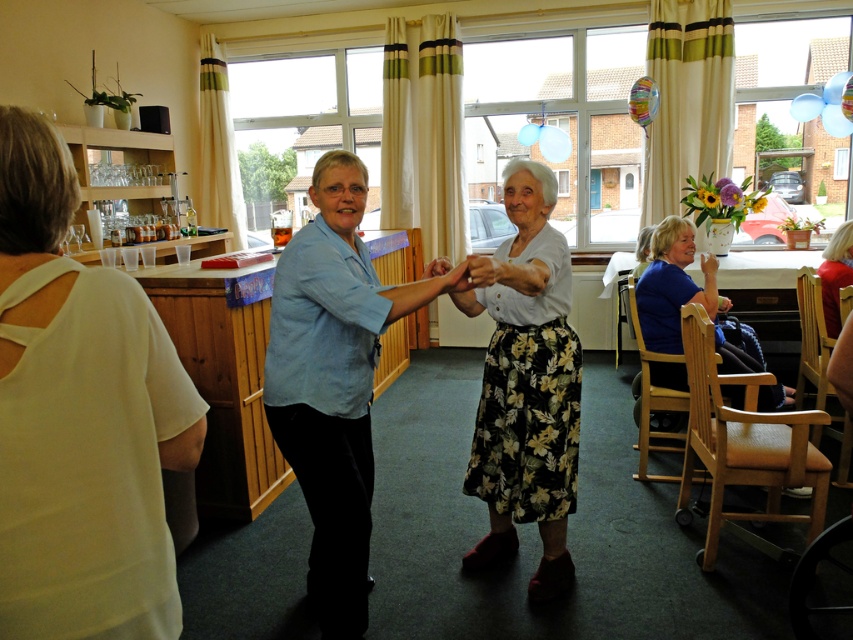
Question: Which point is closer to the camera taking this photo?

Choices:
 (A) (372, 461)
 (B) (846, 276)
 (C) (502, 460)
 (D) (86, 474)

Answer: (D)

Question: Estimate the real-world distances between objects in this image. Which object is closer to the white cotton shirt at left?

Choices:
 (A) blonde hair at right
 (B) blue fabric chair at lower right

Answer: (B)

Question: Based on their relative distances, which object is nearer to the blue fabric chair at lower right?

Choices:
 (A) floral cotton skirt at center
 (B) blonde hair at right
 (C) light blue shirt at center

Answer: (B)

Question: Does blue fabric chair at lower right have a lesser width compared to blonde hair at right?

Choices:
 (A) yes
 (B) no

Answer: (B)

Question: Does white cotton shirt at left have a larger size compared to floral cotton skirt at center?

Choices:
 (A) yes
 (B) no

Answer: (B)

Question: Is blue fabric chair at lower right smaller than blonde hair at right?

Choices:
 (A) yes
 (B) no

Answer: (B)